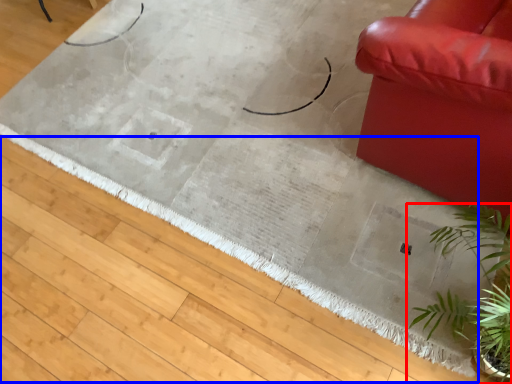
Question: Which point is closer to the camera, houseplant (highlighted by a red box) or doormat (highlighted by a blue box)?

Choices:
 (A) houseplant
 (B) doormat

Answer: (A)